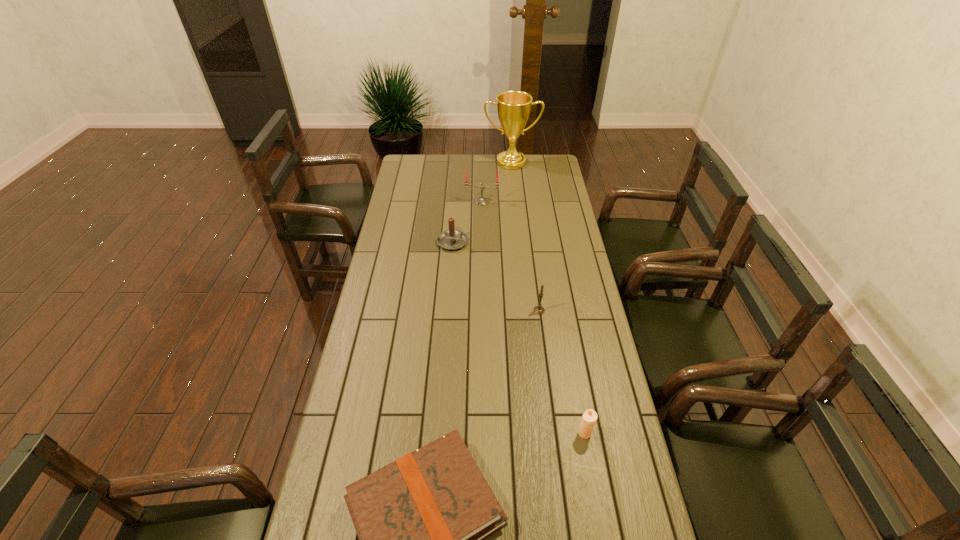
I want to click on object identified as the fifth closest to the second nearest candle, so click(x=513, y=107).

Select which candle appears as the third closest to the shortest object. Please provide its 2D coordinates. Your answer should be formatted as a tuple, i.e. [(x, y)], where the tuple contains the x and y coordinates of a point satisfying the conditions above.

[(451, 239)]

Locate which candle ranks in proximity to the nearest candle. Please provide its 2D coordinates. Your answer should be formatted as a tuple, i.e. [(x, y)], where the tuple contains the x and y coordinates of a point satisfying the conditions above.

[(539, 309)]

The height and width of the screenshot is (540, 960). I want to click on free space that satisfies the following two spatial constraints: 1. on the front side of the fourth farthest object; 2. on the left side of the nearest candle, so click(555, 433).

Identify the location of free space that satisfies the following two spatial constraints: 1. on the front-facing side of the third farthest candle; 2. on the right side of the fifth nearest object. This screenshot has width=960, height=540. (483, 310).

This screenshot has width=960, height=540. I want to click on free location that satisfies the following two spatial constraints: 1. on the front-facing side of the second farthest object; 2. on the left side of the second candle from right to left, so click(x=483, y=310).